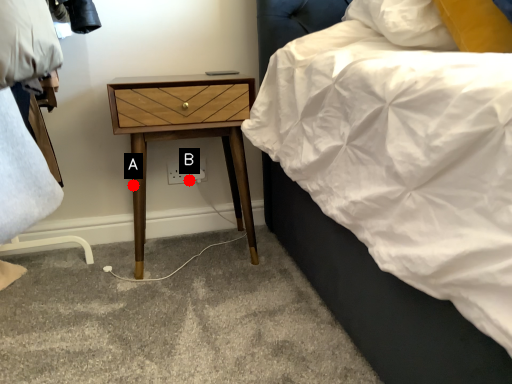
Question: Two points are circled on the image, labeled by A and B beside each circle. Which point is farther to the camera?

Choices:
 (A) A is further
 (B) B is further

Answer: (B)